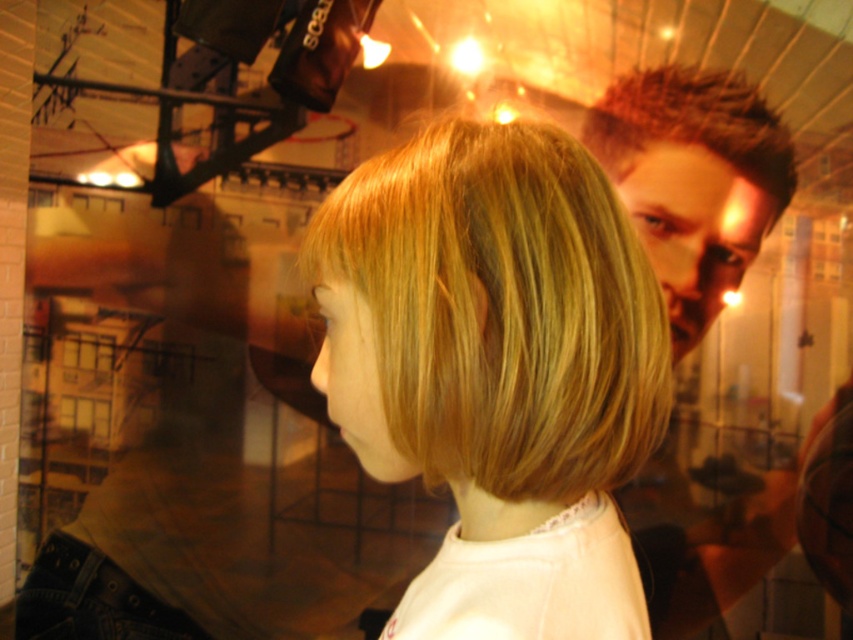
You are a customer in a salon looking at the image. You want to know if your hair covers your clothing. Based on the scene, does the blonde hair at center cover the denim at lower left?

Yes, the blonde hair at center is positioned over denim at lower left, so it covers the denim at lower left.

You are a customer in a salon looking at the mirror. You see the blonde hair at center and the spiky brown hair at upper right in the reflection. Which one is closer to you?

The blonde hair at center is closer to you because it is in front of the spiky brown hair at upper right in the reflection.